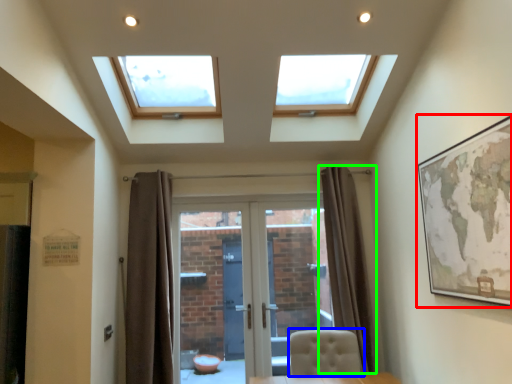
Question: Which object is positioned closest to picture frame (highlighted by a red box)? Select from chair (highlighted by a blue box) and curtain (highlighted by a green box).

Choices:
 (A) chair
 (B) curtain

Answer: (A)